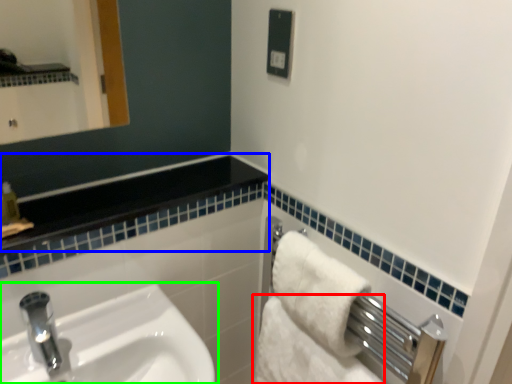
Question: Which object is the farthest from bath towel (highlighted by a red box)? Choose among these: balustrade (highlighted by a blue box) or sink (highlighted by a green box).

Choices:
 (A) balustrade
 (B) sink

Answer: (A)